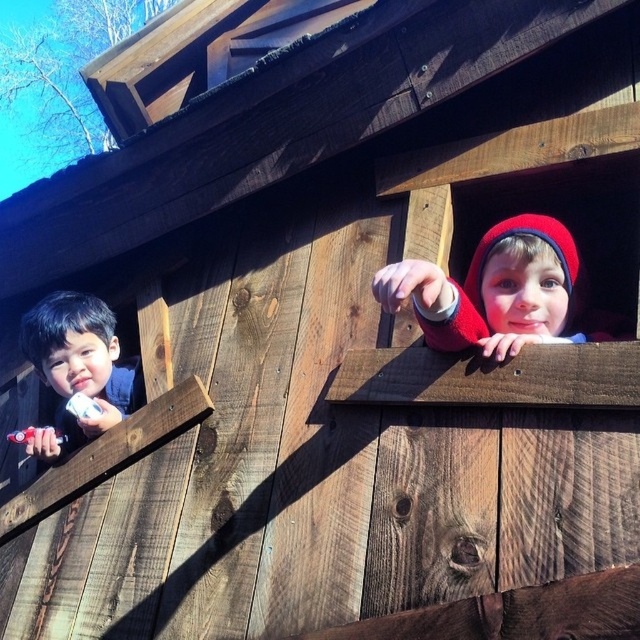
Between red knit hat at upper right and matte white toothbrush at left, which one is positioned lower?

matte white toothbrush at left is lower down.

Locate an element on the screen. This screenshot has width=640, height=640. red knit hat at upper right is located at coordinates (488, 289).

The height and width of the screenshot is (640, 640). I want to click on red knit hat at upper right, so click(488, 289).

Is smooth skin boy at left behind pink matte lips at upper center?

Yes, smooth skin boy at left is further from the viewer.

Who is lower down, smooth skin boy at left or pink matte lips at upper center?

smooth skin boy at left is lower down.

Does point (60, 356) come in front of point (515, 317)?

No, it is behind (515, 317).

Find the location of `smooth skin boy at left`. smooth skin boy at left is located at coordinates (77, 365).

Can you confirm if red knit hat at upper right is positioned above smooth skin boy at left?

Yes.

Does red knit hat at upper right appear under smooth skin boy at left?

Incorrect, red knit hat at upper right is not positioned below smooth skin boy at left.

Identify the location of red knit hat at upper right. (488, 289).